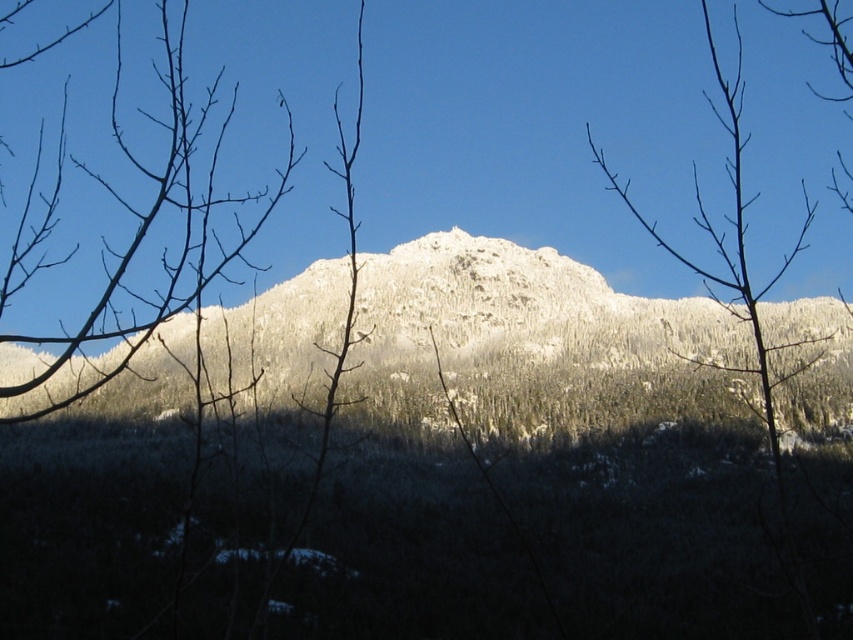
Is point (767, 310) positioned in front of point (639, 221)?

Yes, point (767, 310) is in front of point (639, 221).

Which is in front, point (280, 344) or point (703, 17)?

Point (280, 344)

Where is `white frosty mountain at center`? This screenshot has width=853, height=640. white frosty mountain at center is located at coordinates (527, 308).